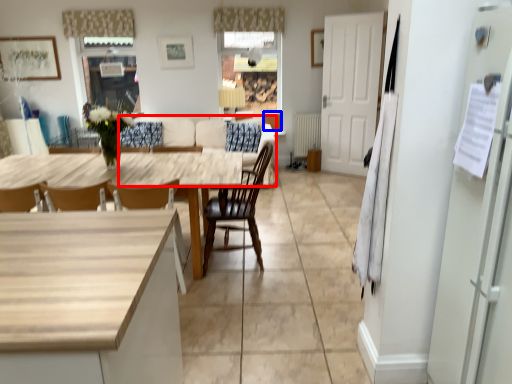
Question: Among these objects, which one is farthest to the camera, couch (highlighted by a red box) or cabinetry (highlighted by a blue box)?

Choices:
 (A) couch
 (B) cabinetry

Answer: (B)